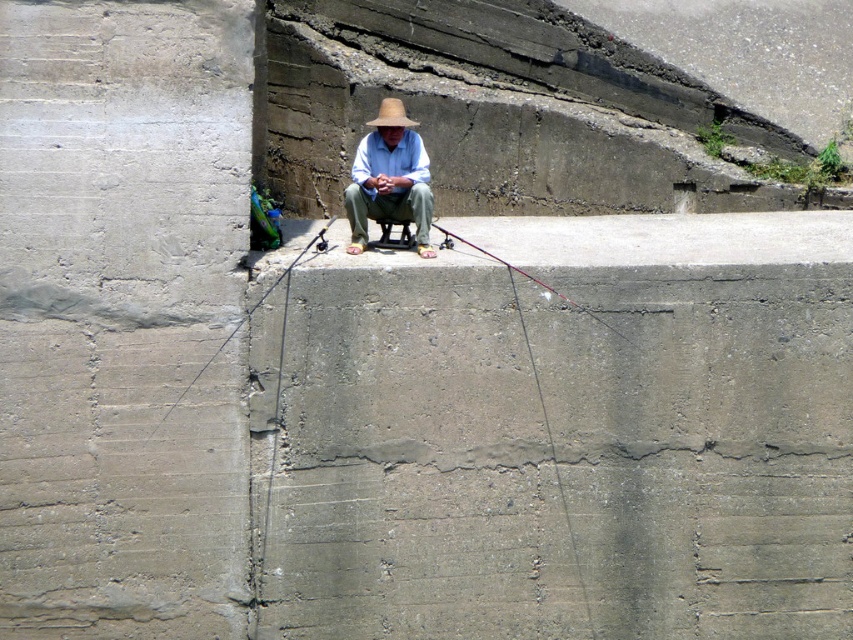
Question: Can you confirm if matte straw hat at center is positioned below beige woven straw hat at center?

Choices:
 (A) no
 (B) yes

Answer: (B)

Question: From the image, what is the correct spatial relationship of matte straw hat at center in relation to beige woven straw hat at center?

Choices:
 (A) above
 (B) below

Answer: (B)

Question: Among these objects, which one is farthest from the camera?

Choices:
 (A) beige woven straw hat at center
 (B) matte straw hat at center

Answer: (A)

Question: Does matte straw hat at center have a lesser width compared to beige woven straw hat at center?

Choices:
 (A) yes
 (B) no

Answer: (B)

Question: Which of the following is the farthest from the observer?

Choices:
 (A) beige woven straw hat at center
 (B) matte straw hat at center

Answer: (A)